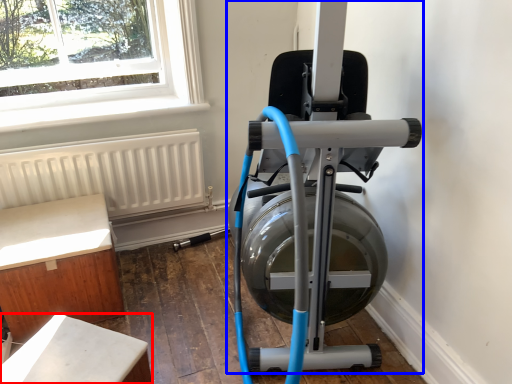
Question: Among these objects, which one is farthest to the camera, furniture (highlighted by a red box) or stationary bicycle (highlighted by a blue box)?

Choices:
 (A) furniture
 (B) stationary bicycle

Answer: (A)